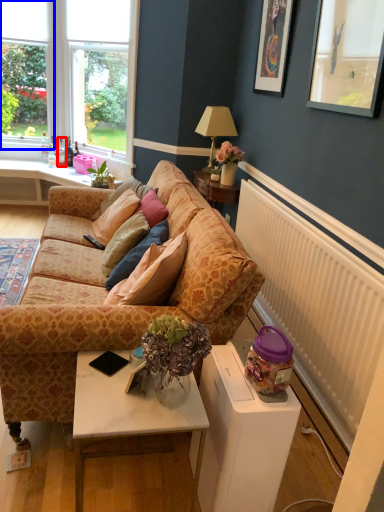
Question: Which object is closer to the camera taking this photo, bottle (highlighted by a red box) or window frame (highlighted by a blue box)?

Choices:
 (A) bottle
 (B) window frame

Answer: (B)